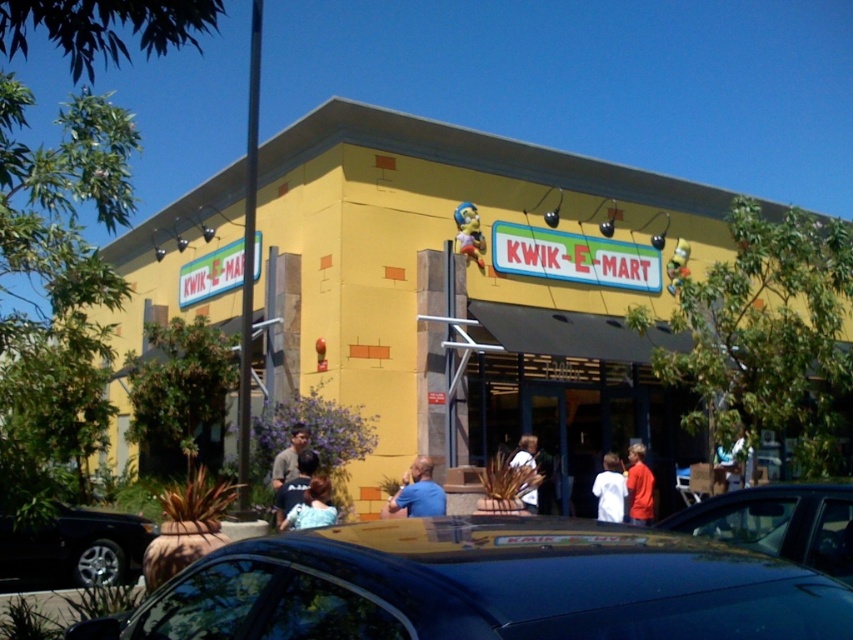
Question: Is red matte shirt at center to the left of white fabric shirt at center from the viewer's perspective?

Choices:
 (A) no
 (B) yes

Answer: (A)

Question: Can you confirm if yellow matte building at center is positioned to the left of shiny black car at lower left?

Choices:
 (A) yes
 (B) no

Answer: (B)

Question: Which is farther from the shiny blue car at center?

Choices:
 (A) blue fabric shirt at center
 (B) white fabric shirt at center
 (C) yellow matte building at center

Answer: (C)

Question: Among these objects, which one is nearest to the camera?

Choices:
 (A) shiny black car at lower left
 (B) blue denim shirt at center
 (C) red matte shirt at center
 (D) yellow matte building at center

Answer: (B)

Question: Which point is closer to the camera?

Choices:
 (A) (610, 458)
 (B) (457, 406)

Answer: (A)

Question: Can you confirm if shiny black car at center is positioned to the left of shiny blue car at center?

Choices:
 (A) yes
 (B) no

Answer: (A)